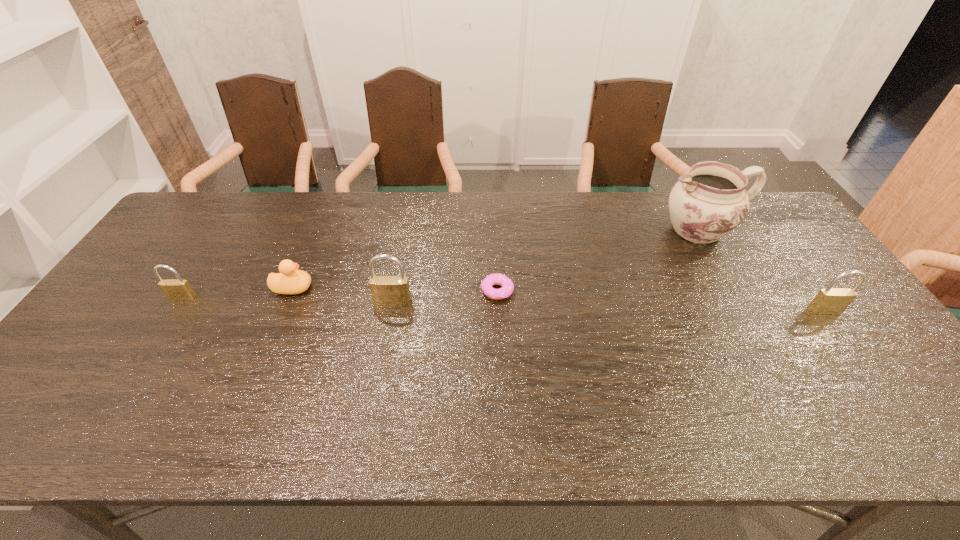
What are the coordinates of `object positioned at the left edge` in the screenshot? It's located at (174, 289).

Locate an element on the screen. Image resolution: width=960 pixels, height=540 pixels. padlock that is at the right edge is located at coordinates (831, 300).

You are a GUI agent. You are given a task and a screenshot of the screen. Output one action in this format:
    pyautogui.click(x=<x>, y=<y>)
    Task: Click on the pitcher located at the right edge
    The height and width of the screenshot is (540, 960).
    Given the screenshot: What is the action you would take?
    pyautogui.click(x=705, y=205)

Identify the location of object at the far right corner. (705, 205).

At what (x,y) coordinates should I click in order to perform the action: click on free spot at the far edge of the desktop. Please return your answer as a coordinate pair (x, y). This screenshot has width=960, height=540. Looking at the image, I should click on (503, 221).

The image size is (960, 540). Find the location of `vacant space at the near edge of the desktop`. vacant space at the near edge of the desktop is located at coordinates (187, 370).

Where is `blank space at the left edge of the desktop`? This screenshot has width=960, height=540. blank space at the left edge of the desktop is located at coordinates (161, 303).

Image resolution: width=960 pixels, height=540 pixels. In order to click on vacant space at the right edge in this screenshot , I will do `click(882, 345)`.

Where is `blank area at the far left corner`? The width and height of the screenshot is (960, 540). blank area at the far left corner is located at coordinates (185, 210).

Find the location of a particular element. Image resolution: width=960 pixels, height=540 pixels. vacant area between the farthest object and the fourth object from left to right is located at coordinates (599, 260).